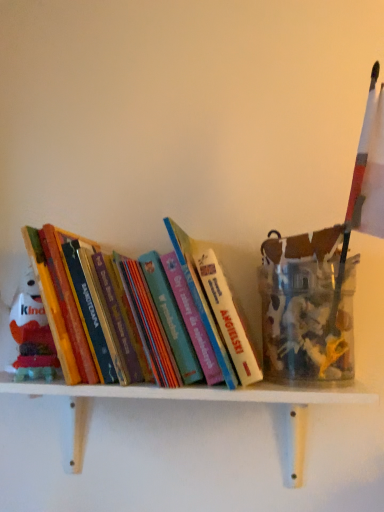
Question: From the image's perspective, is hardcover books at center on white wooden shelf at center?

Choices:
 (A) no
 (B) yes

Answer: (B)

Question: Can you confirm if hardcover books at center is wider than white wooden shelf at center?

Choices:
 (A) yes
 (B) no

Answer: (A)

Question: Considering the relative sizes of hardcover books at center and white wooden shelf at center in the image provided, is hardcover books at center thinner than white wooden shelf at center?

Choices:
 (A) yes
 (B) no

Answer: (B)

Question: From a real-world perspective, is hardcover books at center located beneath white wooden shelf at center?

Choices:
 (A) yes
 (B) no

Answer: (B)

Question: Is white wooden shelf at center a part of hardcover books at center?

Choices:
 (A) no
 (B) yes

Answer: (A)

Question: Is hardcover books at center completely or partially outside of white wooden shelf at center?

Choices:
 (A) yes
 (B) no

Answer: (A)

Question: From the image's perspective, would you say white wooden shelf at center is shown under hardcover books at center?

Choices:
 (A) no
 (B) yes

Answer: (B)

Question: Is white wooden shelf at center closer to camera compared to hardcover books at center?

Choices:
 (A) no
 (B) yes

Answer: (B)

Question: Can you confirm if white wooden shelf at center is positioned to the left of hardcover books at center?

Choices:
 (A) no
 (B) yes

Answer: (A)

Question: From a real-world perspective, is white wooden shelf at center physically above hardcover books at center?

Choices:
 (A) yes
 (B) no

Answer: (B)

Question: Can you confirm if white wooden shelf at center is shorter than hardcover books at center?

Choices:
 (A) no
 (B) yes

Answer: (B)

Question: Can you confirm if white wooden shelf at center is taller than hardcover books at center?

Choices:
 (A) no
 (B) yes

Answer: (A)

Question: From the image's perspective, is white wooden shelf at center located above or below hardcover books at center?

Choices:
 (A) above
 (B) below

Answer: (B)